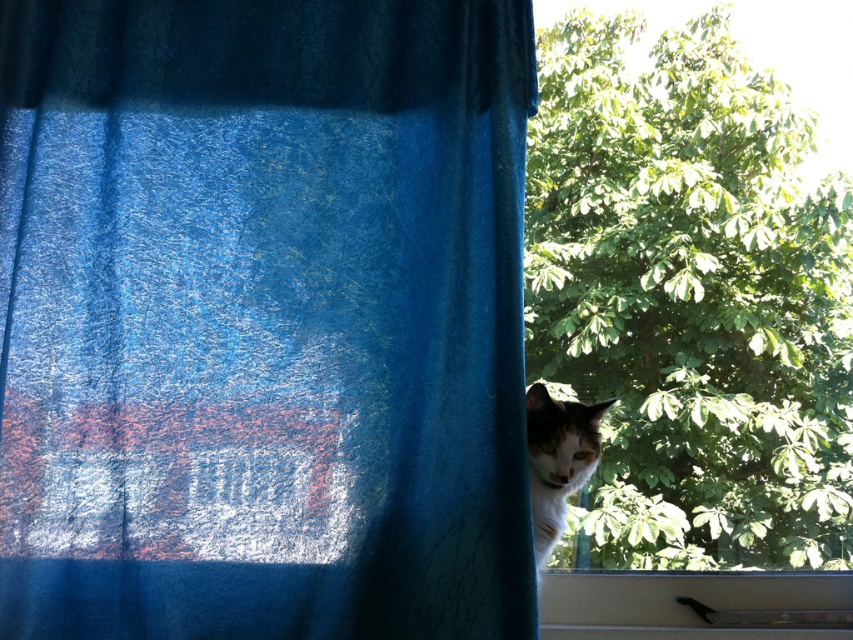
Question: Which object is positioned farthest from the white plastic window sill at lower right?

Choices:
 (A) white fur cat at window right
 (B) transparent glass window at center

Answer: (A)

Question: Which point is closer to the camera taking this photo?

Choices:
 (A) (613, 289)
 (B) (834, 588)
 (C) (509, 436)
 (D) (543, 438)

Answer: (C)

Question: Is white plastic window sill at lower right bigger than white fur cat at window right?

Choices:
 (A) yes
 (B) no

Answer: (A)

Question: Does blue velvet curtain at center have a smaller size compared to transparent glass window at center?

Choices:
 (A) no
 (B) yes

Answer: (B)

Question: Which of the following is the farthest from the observer?

Choices:
 (A) blue velvet curtain at center
 (B) white plastic window sill at lower right

Answer: (B)

Question: Can you confirm if blue velvet curtain at center is wider than white fur cat at window right?

Choices:
 (A) no
 (B) yes

Answer: (B)